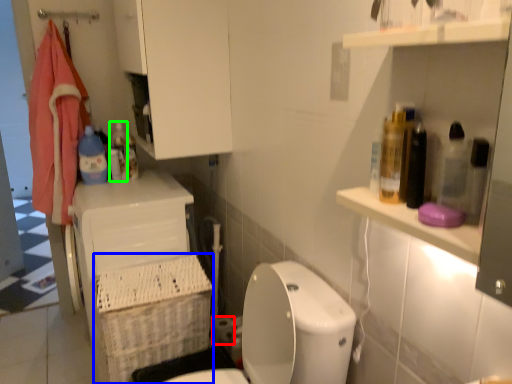
Question: Which object is the closest to the toilet paper (highlighted by a red box)? Choose among these: basket (highlighted by a blue box) or bottle (highlighted by a green box).

Choices:
 (A) basket
 (B) bottle

Answer: (A)